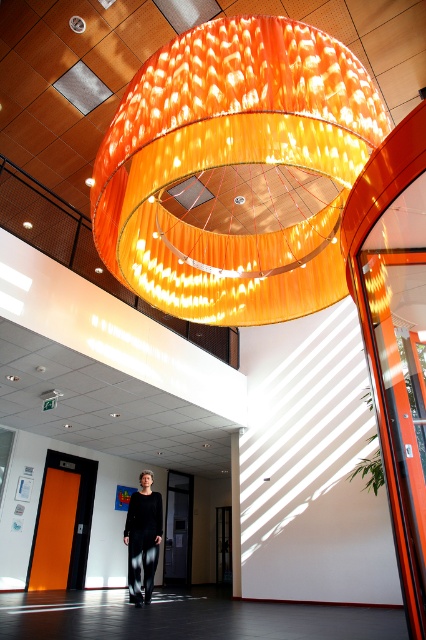
Can you confirm if orange glossy chandelier at center is taller than black textured pants at center?

Incorrect, orange glossy chandelier at center's height is not larger of black textured pants at center's.

What do you see at coordinates (236, 170) in the screenshot? This screenshot has height=640, width=426. I see `orange glossy chandelier at center` at bounding box center [236, 170].

The height and width of the screenshot is (640, 426). In order to click on orange glossy chandelier at center in this screenshot , I will do [x=236, y=170].